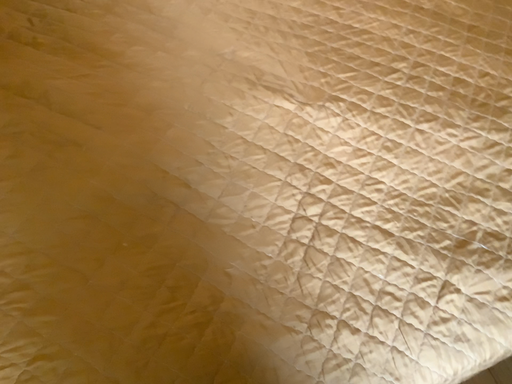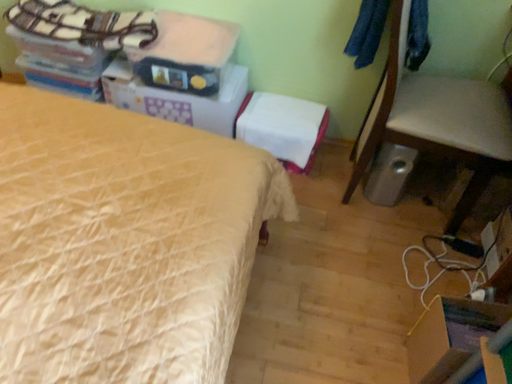
Question: Which way did the camera rotate in the video?

Choices:
 (A) rotated left
 (B) rotated right

Answer: (B)